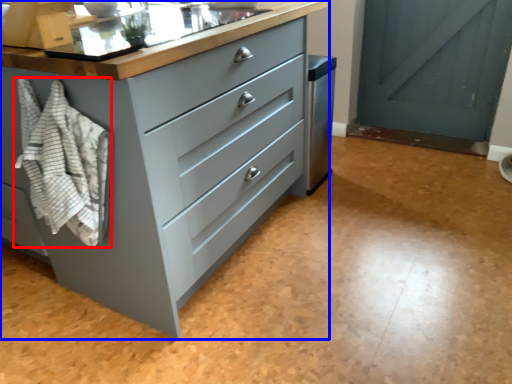
Question: Which of the following is the farthest to the observer, blanket (highlighted by a red box) or chest of drawers (highlighted by a blue box)?

Choices:
 (A) blanket
 (B) chest of drawers

Answer: (A)